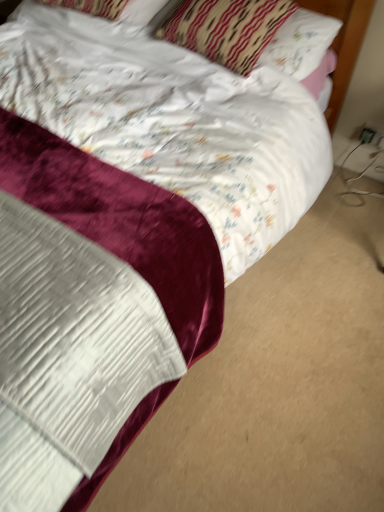
Question: Is patterned fabric pillow at upper center, which appears as the 2th pillow when viewed from the left, spatially inside white plastic electric outlet at lower right, which appears as the 2th electric outlet when viewed from the left, or outside of it?

Choices:
 (A) outside
 (B) inside

Answer: (A)

Question: In terms of size, does patterned fabric pillow at upper center, which appears as the 2th pillow when viewed from the left, appear bigger or smaller than white plastic electric outlet at lower right, marked as the first electric outlet in a right-to-left arrangement?

Choices:
 (A) big
 (B) small

Answer: (A)

Question: Which of these objects is positioned farthest from the white satin pillow at upper center, which is the 2th pillow from right to left?

Choices:
 (A) black plastic outlet at lower right, the 1th electric outlet positioned from the left
 (B) patterned fabric pillow at upper center, which appears as the 2th pillow when viewed from the left
 (C) white plastic electric outlet at lower right, which appears as the 2th electric outlet when viewed from the left

Answer: (A)

Question: Which object is the farthest from the white satin pillow at upper center, which is the 2th pillow from right to left?

Choices:
 (A) patterned fabric pillow at upper center, which is the first pillow in right-to-left order
 (B) black plastic outlet at lower right, which ranks as the 2th electric outlet in right-to-left order
 (C) white plastic electric outlet at lower right, which appears as the 2th electric outlet when viewed from the left

Answer: (B)